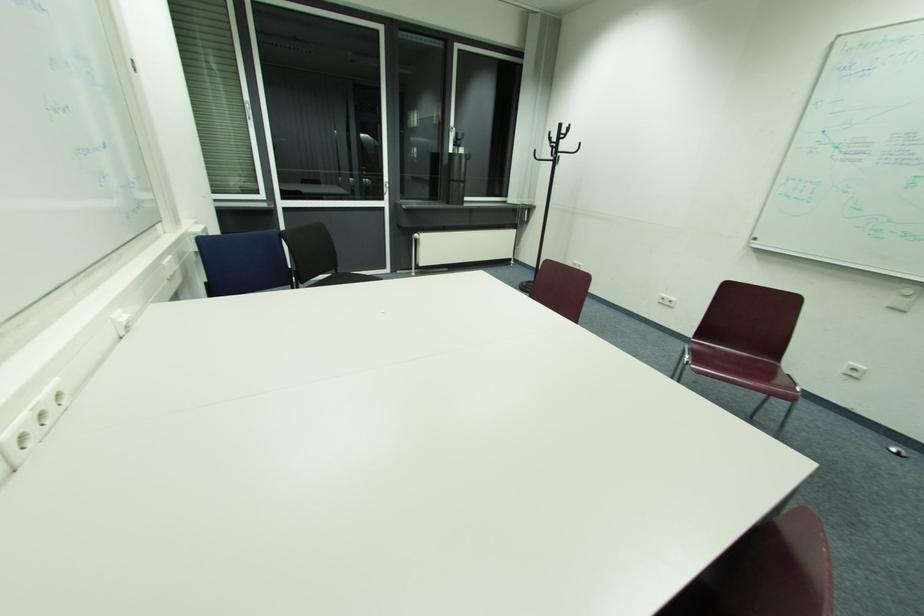
Find where to plac the black cylindrical container. Please return your answer as a coordinate pair (x, y).

(454, 177)